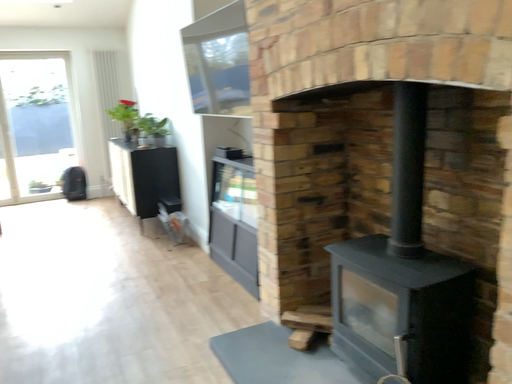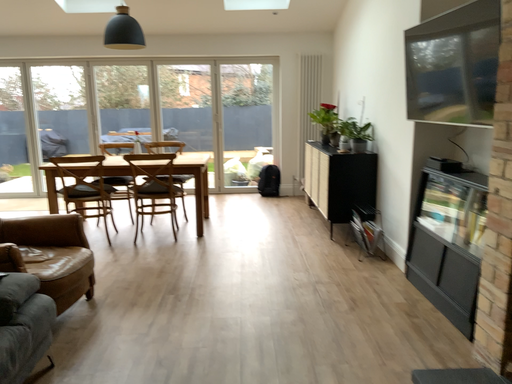
Question: How did the camera likely rotate when shooting the video?

Choices:
 (A) rotated right
 (B) rotated left

Answer: (B)